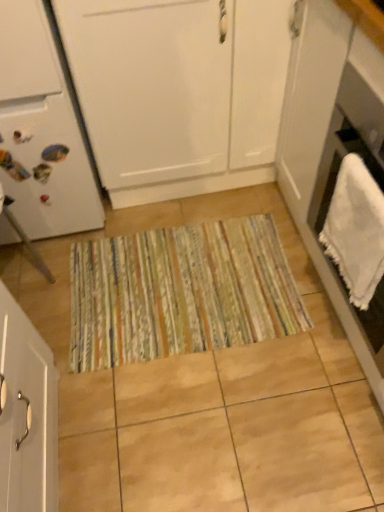
Describe the element at coordinates (356, 230) in the screenshot. I see `white fluffy towel at right` at that location.

I want to click on white fluffy towel at right, so click(x=356, y=230).

In terms of size, does white matte cabinet at center, the second cabinetry positioned from the bottom, appear bigger or smaller than white towel at right?

In the image, white matte cabinet at center, the second cabinetry positioned from the bottom, appears to be larger than white towel at right.

Is white matte cabinet at center, the second cabinetry positioned from the bottom, aimed at white towel at right?

Yes, white matte cabinet at center, the second cabinetry positioned from the bottom, is turned towards white towel at right.

From the image's perspective, which one is positioned higher, white matte cabinet at center, the first cabinetry from the top, or white towel at right?

From the image's view, white matte cabinet at center, the first cabinetry from the top, is above.

At what (x,y) coordinates should I click in order to perform the action: click on home appliance behind the white fluffy towel at right. Please return your answer as a coordinate pair (x, y). The image size is (384, 512). Looking at the image, I should click on (42, 129).

From a real-world perspective, is white fluffy towel at right on top of white matte refrigerator at left?

Yes.

Which object is positioned more to the left, white fluffy towel at right or white matte refrigerator at left?

white matte refrigerator at left.

Is white matte refrigerator at left inside white fluffy towel at right?

No, white matte refrigerator at left is not surrounded by white fluffy towel at right.

Considering the sizes of objects white towel at right and white matte cabinet at center, the first cabinetry from the top, in the image provided, who is smaller, white towel at right or white matte cabinet at center, the first cabinetry from the top,?

With smaller size is white towel at right.

Is point (383, 329) positioned before point (113, 120)?

Yes, it is.

Based on their positions, is white towel at right located to the left or right of white matte cabinet at center, the first cabinetry from the top?

From the image, it's evident that white towel at right is to the right of white matte cabinet at center, the first cabinetry from the top.

Locate an element on the screen. cabinetry that appears above the white towel at right (from the image's perspective) is located at coordinates (178, 91).

In order to click on oven directly beneath the white fluffy towel at right (from a real-world perspective) in this screenshot , I will do `click(334, 188)`.

From the image's perspective, is white towel at right below white fluffy towel at right?

No.

Who is smaller, white towel at right or white fluffy towel at right?

white fluffy towel at right is smaller.

How many degrees apart are the facing directions of striped fabric doormat at center and white matte refrigerator at left?

The facing directions of striped fabric doormat at center and white matte refrigerator at left are 2.92 degrees apart.

Which object is thinner, striped fabric doormat at center or white matte refrigerator at left?

Thinner between the two is striped fabric doormat at center.

Considering the relative sizes of striped fabric doormat at center and white matte refrigerator at left in the image provided, is striped fabric doormat at center shorter than white matte refrigerator at left?

Yes.

Is striped fabric doormat at center directly adjacent to white matte refrigerator at left?

striped fabric doormat at center and white matte refrigerator at left are not in contact.

Is white matte cabinet at center, the first cabinetry from the top, not within white fluffy towel at right?

Yes.

Does white matte cabinet at center, the first cabinetry from the top, have a lesser width compared to white fluffy towel at right?

No, white matte cabinet at center, the first cabinetry from the top, is not thinner than white fluffy towel at right.

Does white matte cabinet at center, the first cabinetry from the top, have a larger size compared to white fluffy towel at right?

Yes.

How much distance is there between white matte cabinet at center, the second cabinetry positioned from the bottom, and white fluffy towel at right?

white matte cabinet at center, the second cabinetry positioned from the bottom, and white fluffy towel at right are 27.57 inches apart from each other.

Considering the positions of objects white matte refrigerator at left and white matte cabinet at lower left, the first cabinetry from the bottom, in the image provided, who is more to the right, white matte refrigerator at left or white matte cabinet at lower left, the first cabinetry from the bottom,?

white matte cabinet at lower left, the first cabinetry from the bottom, is more to the right.

This screenshot has width=384, height=512. I want to click on the 1st cabinetry counting from the right side of the white matte refrigerator at left, so click(26, 414).

Which is behind, white matte refrigerator at left or white matte cabinet at lower left, the second cabinetry when ordered from top to bottom?

white matte refrigerator at left is more distant.

From a real-world perspective, count 1st cabinetrys downward from the white towel at right and point to it. Please provide its 2D coordinates.

[(178, 91)]

At what (x,y) coordinates should I click in order to perform the action: click on home appliance on the left of white fluffy towel at right. Please return your answer as a coordinate pair (x, y). The image size is (384, 512). Looking at the image, I should click on (42, 129).

Consider the image. Estimate the real-world distances between objects in this image. Which object is further from striped fabric doormat at center, white towel at right or white matte cabinet at center, the first cabinetry from the top?

white matte cabinet at center, the first cabinetry from the top, is further to striped fabric doormat at center.

When comparing their distances from white fluffy towel at right, does white towel at right or white matte refrigerator at left seem further?

white matte refrigerator at left lies further to white fluffy towel at right than the other object.

When comparing their distances from striped fabric doormat at center, does white fluffy towel at right or white matte cabinet at lower left, the second cabinetry when ordered from top to bottom, seem closer?

The object closer to striped fabric doormat at center is white matte cabinet at lower left, the second cabinetry when ordered from top to bottom.

Considering their positions, is white matte cabinet at lower left, the second cabinetry when ordered from top to bottom, positioned closer to striped fabric doormat at center than white towel at right?

Based on the image, white matte cabinet at lower left, the second cabinetry when ordered from top to bottom, appears to be nearer to striped fabric doormat at center.

Considering their positions, is white towel at right positioned further to white matte refrigerator at left than striped fabric doormat at center?

white towel at right is positioned further to the anchor white matte refrigerator at left.

Considering their positions, is white matte cabinet at center, the first cabinetry from the top, positioned closer to white towel at right than white matte refrigerator at left?

The object closer to white towel at right is white matte cabinet at center, the first cabinetry from the top.

Considering their positions, is white matte refrigerator at left positioned further to white towel at right than white fluffy towel at right?

white matte refrigerator at left.

Considering their positions, is striped fabric doormat at center positioned further to white matte cabinet at lower left, the second cabinetry when ordered from top to bottom, than white towel at right?

white towel at right is positioned further to the anchor white matte cabinet at lower left, the second cabinetry when ordered from top to bottom.

What are the coordinates of `doormat between white matte refrigerator at left and white matte cabinet at lower left, the first cabinetry from the bottom, vertically` in the screenshot? It's located at (180, 292).

Identify the location of doormat between white matte cabinet at lower left, the second cabinetry when ordered from top to bottom, and white towel at right from left to right. pyautogui.click(x=180, y=292).

This screenshot has width=384, height=512. Find the location of `doormat that lies between white matte cabinet at center, the first cabinetry from the top, and white matte cabinet at lower left, the second cabinetry when ordered from top to bottom, from top to bottom`. doormat that lies between white matte cabinet at center, the first cabinetry from the top, and white matte cabinet at lower left, the second cabinetry when ordered from top to bottom, from top to bottom is located at coordinates (180, 292).

At what (x,y) coordinates should I click in order to perform the action: click on home appliance between white matte cabinet at center, the first cabinetry from the top, and striped fabric doormat at center from top to bottom. Please return your answer as a coordinate pair (x, y). This screenshot has height=512, width=384. Looking at the image, I should click on (42, 129).